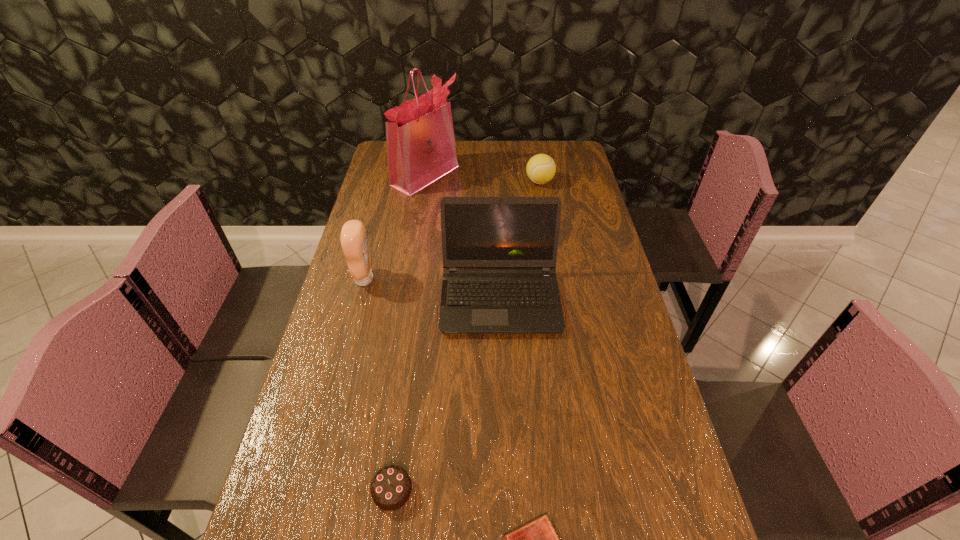
In order to click on free spot located 0.180m on the back of the second nearest object in this screenshot , I will do `click(405, 395)`.

Identify the location of object located at the far edge. Image resolution: width=960 pixels, height=540 pixels. (421, 148).

The width and height of the screenshot is (960, 540). Find the location of `shopping bag at the left edge`. shopping bag at the left edge is located at coordinates (421, 148).

The image size is (960, 540). What are the coordinates of `condiment that is at the left edge` in the screenshot? It's located at pyautogui.click(x=353, y=237).

The height and width of the screenshot is (540, 960). I want to click on object that is positioned at the right edge, so click(541, 168).

Identify the location of object that is at the far left corner. This screenshot has height=540, width=960. (421, 148).

Identify the location of free location at the left edge. (396, 225).

Where is `vacant space at the right edge`? Image resolution: width=960 pixels, height=540 pixels. vacant space at the right edge is located at coordinates click(x=619, y=458).

In order to click on vacant area between the second nearest object and the fifth shortest object in this screenshot , I will do `click(446, 394)`.

What are the coordinates of `empty space between the fourth shortest object and the second tallest object` in the screenshot? It's located at (432, 288).